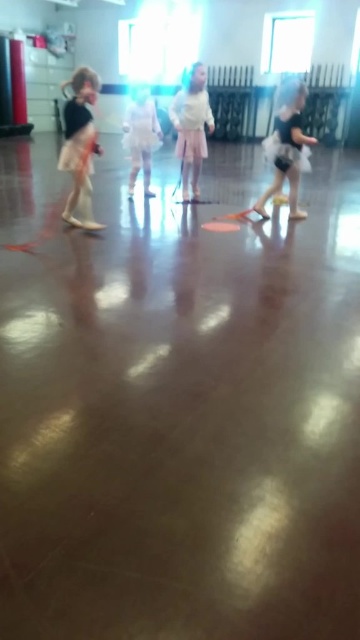
In the dance studio scene, there are two girls wearing a white cotton dress at center and a black tulle skirt at right. Which one is positioned more towards the left side of the image?

The white cotton dress at center is positioned more towards the left side of the image compared to the black tulle skirt at right.

You are a photographer positioned at the entrance of the dance studio. You need to capture a photo of the black tulle skirt at right. Based on its position, where should you aim your camera to ensure it is centered in the frame?

The black tulle skirt at right is located at point 0.233 on the horizontal axis and 0.800 on the vertical axis. To center it in the frame, aim your camera towards those coordinates.